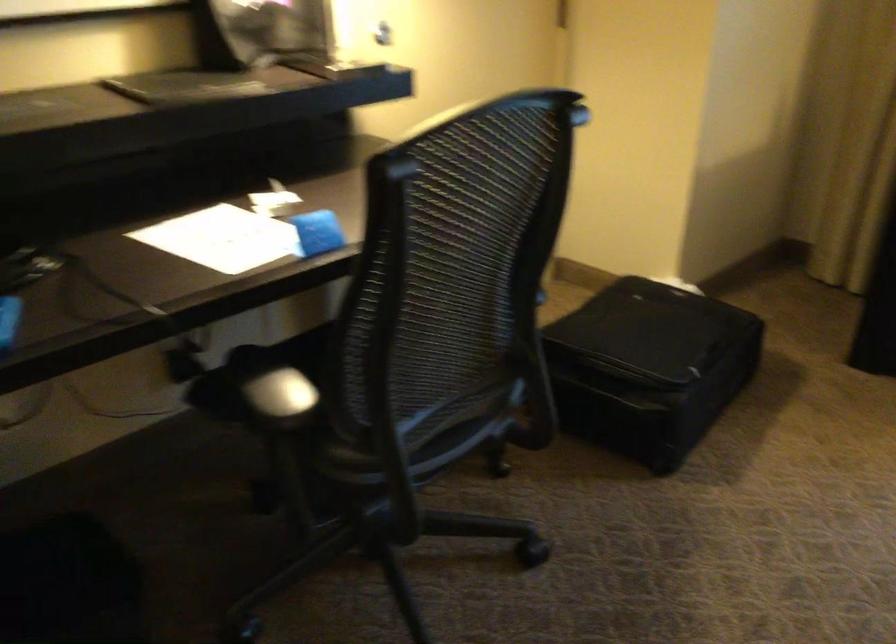
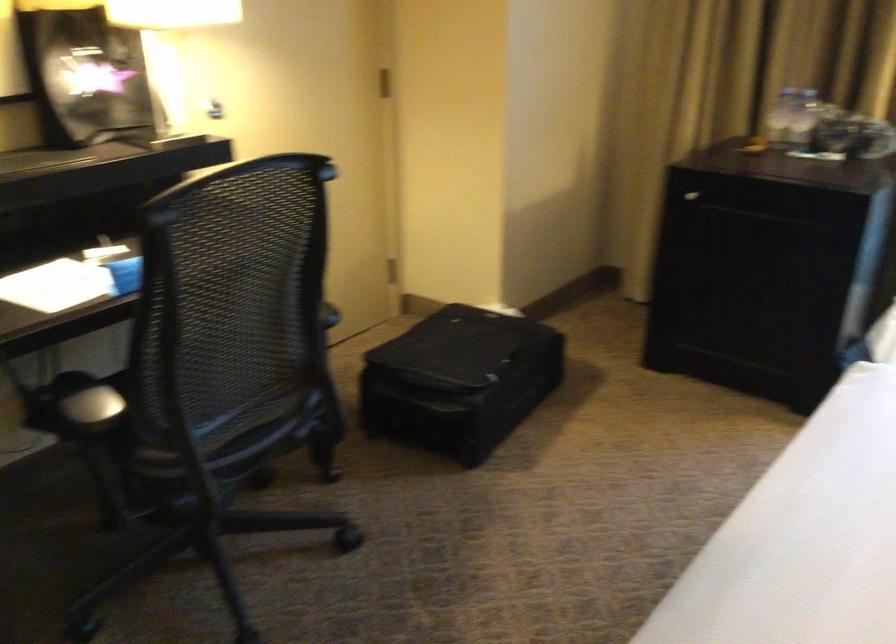
In a continuous first-person perspective shot, in which direction is the camera moving?

The movement direction of the cameraman is right, backward.